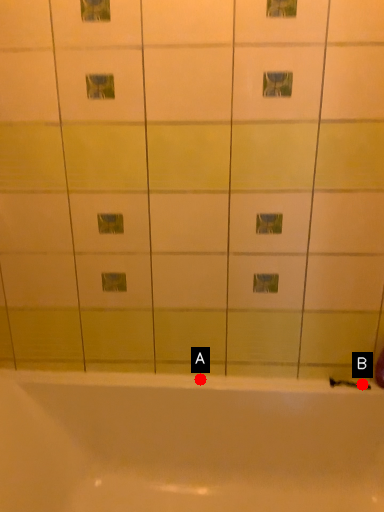
Question: Two points are circled on the image, labeled by A and B beside each circle. Which point is closer to the camera?

Choices:
 (A) A is closer
 (B) B is closer

Answer: (B)